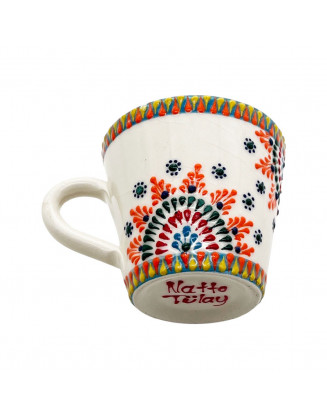
The image size is (327, 420). Identify the location of mug handle. (67, 233).